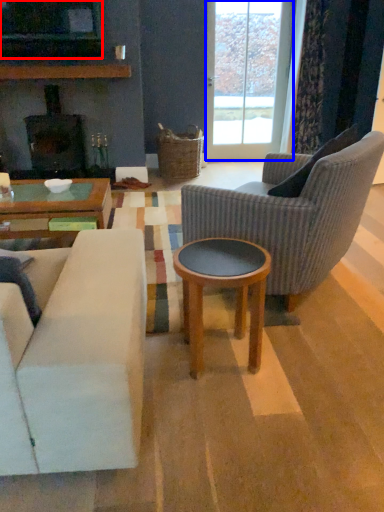
Question: Among these objects, which one is nearest to the camera, television (highlighted by a red box) or glass door (highlighted by a blue box)?

Choices:
 (A) television
 (B) glass door

Answer: (A)